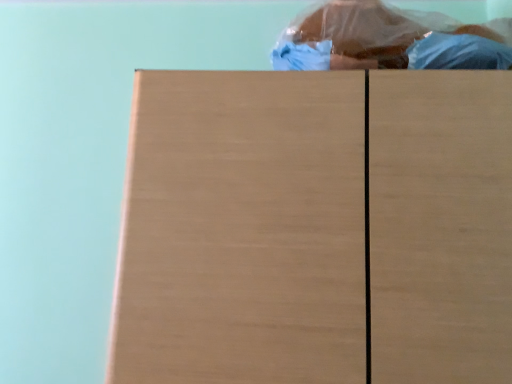
Question: Is point (375, 294) closer or farther from the camera than point (331, 11)?

Choices:
 (A) farther
 (B) closer

Answer: (B)

Question: Considering the positions of light brown wood at center and blue plastic bag at upper center in the image, is light brown wood at center wider or thinner than blue plastic bag at upper center?

Choices:
 (A) wide
 (B) thin

Answer: (A)

Question: Considering the positions of light brown wood at center and blue plastic bag at upper center in the image, is light brown wood at center bigger or smaller than blue plastic bag at upper center?

Choices:
 (A) big
 (B) small

Answer: (A)

Question: Is blue plastic bag at upper center in front of or behind light brown wood at center in the image?

Choices:
 (A) front
 (B) behind

Answer: (B)

Question: Considering the positions of blue plastic bag at upper center and light brown wood at center in the image, is blue plastic bag at upper center wider or thinner than light brown wood at center?

Choices:
 (A) wide
 (B) thin

Answer: (B)

Question: From their relative heights in the image, would you say blue plastic bag at upper center is taller or shorter than light brown wood at center?

Choices:
 (A) short
 (B) tall

Answer: (A)

Question: In the image, is blue plastic bag at upper center on the left side or the right side of light brown wood at center?

Choices:
 (A) right
 (B) left

Answer: (A)